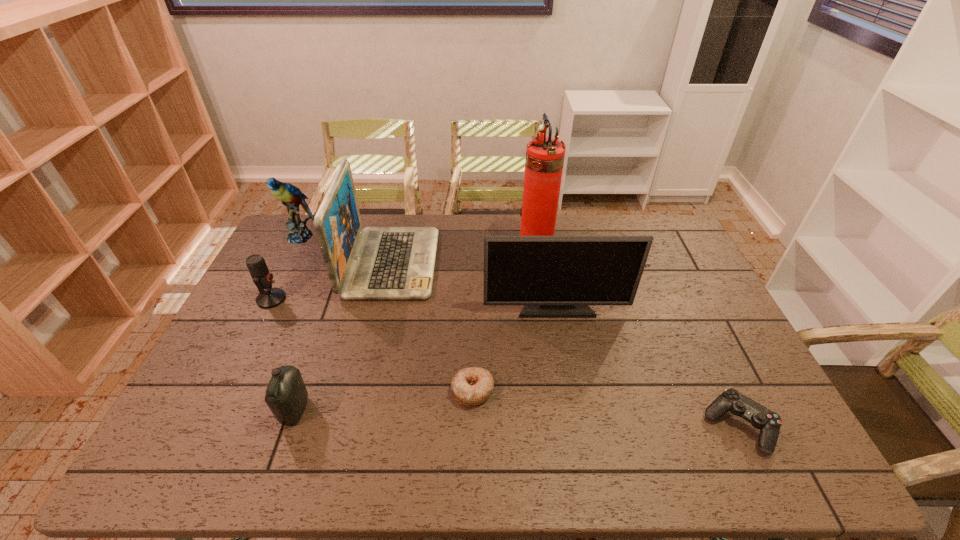
The height and width of the screenshot is (540, 960). I want to click on laptop computer located in the far edge section of the desktop, so click(375, 263).

Locate an element on the screen. Image resolution: width=960 pixels, height=540 pixels. parrot positioned at the far edge is located at coordinates (291, 197).

At what (x,y) coordinates should I click in order to perform the action: click on object that is at the near edge. Please return your answer as a coordinate pair (x, y). Looking at the image, I should click on (769, 423).

The image size is (960, 540). What are the coordinates of `parrot located at the left edge` in the screenshot? It's located at (291, 197).

At what (x,y) coordinates should I click in order to perform the action: click on microphone at the left edge. Please return your answer as a coordinate pair (x, y). The image size is (960, 540). Looking at the image, I should click on (271, 297).

Locate an element on the screen. object present at the right edge is located at coordinates (769, 423).

Find the location of a particular element. The image size is (960, 540). object located at the far left corner is located at coordinates (291, 197).

Identify the location of object at the near right corner. The width and height of the screenshot is (960, 540). (769, 423).

The image size is (960, 540). I want to click on free location at the far edge of the desktop, so click(x=572, y=214).

Where is `free region at the near edge of the desktop`? free region at the near edge of the desktop is located at coordinates (476, 452).